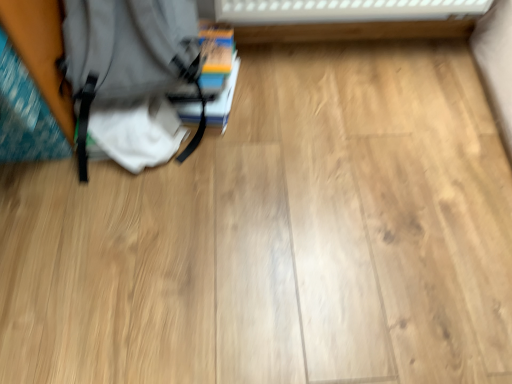
Find the location of a particular element. free space on the front side of hardcover book at center-left is located at coordinates 240,167.